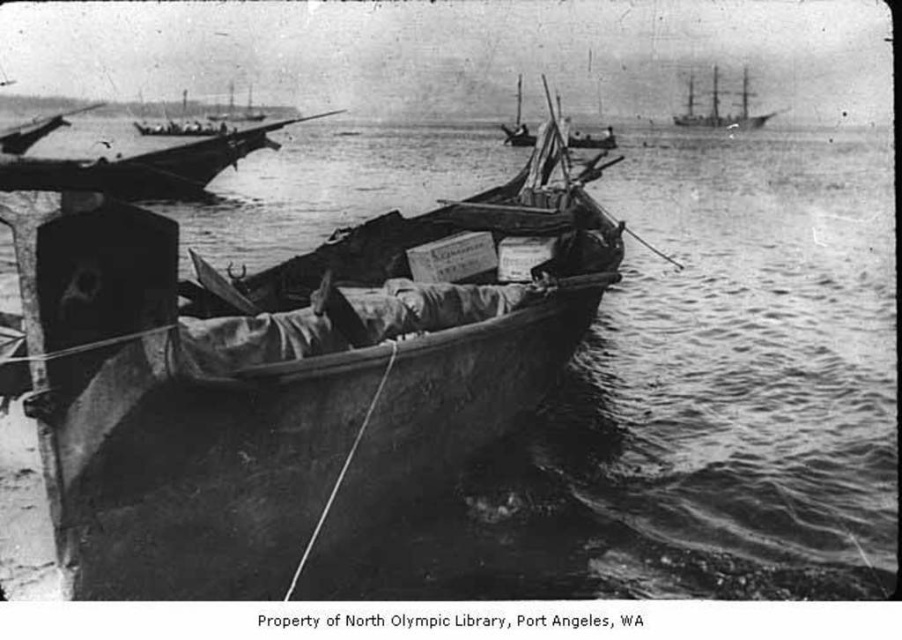
You are a sailor navigating a small wooden boat in the image. You need to reach a specific point marked by coordinates. Which object in the scene is located exactly at the point with coordinates (x=284, y=374)?

The wooden boat at center is located exactly at the point with coordinates (x=284, y=374).

Looking at this image, you are a sailor who needs to navigate between the wooden boat at center and the wooden boat at upper left. The channel between them is 72.82 feet wide. If your ship requires a minimum of 60 feet to safely pass through, can you safely navigate through the channel?

The channel between the wooden boat at center and the wooden boat at upper left is 72.82 feet wide, which is wider than the required 60 feet. Therefore, you can safely navigate through the channel between the wooden boat at center and the wooden boat at upper left.